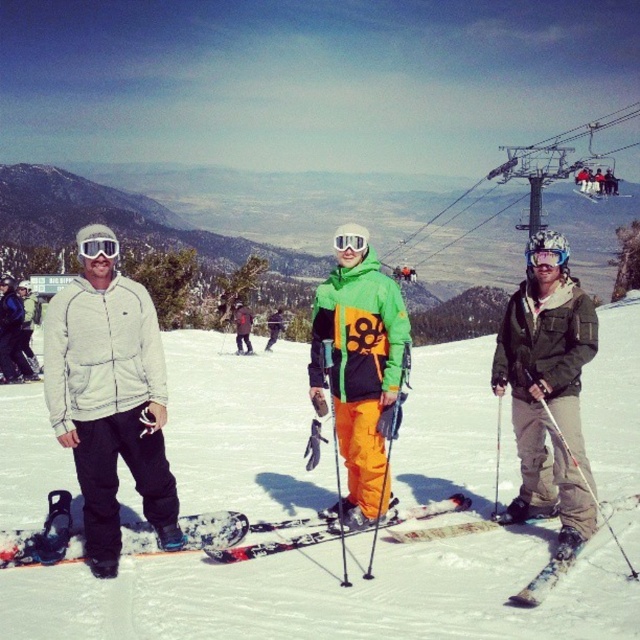
You are a photographer trying to capture a wide shot of the ski resort scene. You notice the neon orange ski pants at center and the metallic cable car at upper center. Which object should you focus on first if you want to ensure both are in frame without moving the camera? Explain your reasoning based on their sizes.

The neon orange ski pants at center is thinner than the metallic cable car at upper center. Since the neon orange ski pants at center is smaller in width, you should focus on positioning the metallic cable car at upper center first, as it occupies more space and will require more careful framing to include both objects without moving the camera.

You are standing at the bottom of the slope and want to locate the orange fabric pants at center. Based on the coordinates provided, in which direction should you look relative to your current position?

The orange fabric pants at center are located at coordinates point (330, 595), which is to the upper right direction from your current position at the bottom of the slope.